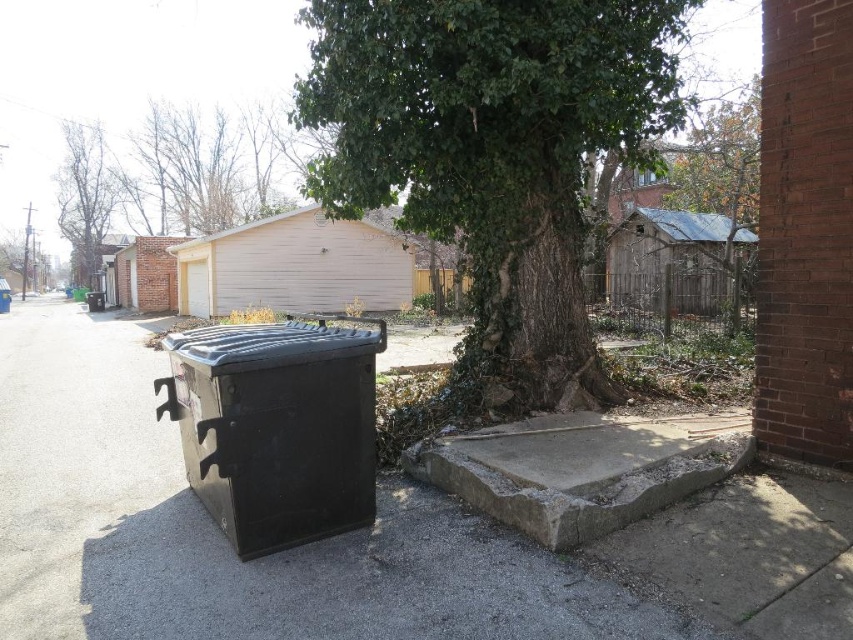
You are standing at the entrance of the residential area and see the black plastic trash can at lower left and the green leafy tree at upper center. Which object is closer to the entrance?

The black plastic trash can at lower left is positioned on the right side of the green leafy tree at upper center, so the tree is closer to the entrance than the trash can.

You are a gardener assessing the space between the black plastic trash can at lower left and the green leafy tree at upper center. Which object is taller?

The green leafy tree at upper center is taller than the black plastic trash can at lower left.

You are a delivery person trying to park your small electric cart near the black plastic trash can at lower left and the gray concrete curb at lower center. Which object should you avoid to ensure enough space for your cart?

You should avoid the black plastic trash can at lower left because it is larger in size than the gray concrete curb at lower center, so there might be less space around it for parking.